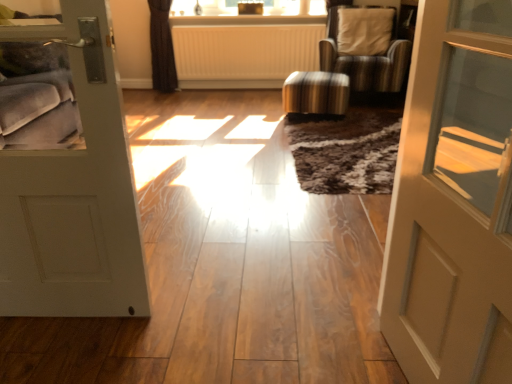
Identify the location of striped fabric chair at center. This screenshot has width=512, height=384. (369, 58).

What do you see at coordinates (369, 58) in the screenshot? I see `striped fabric chair at center` at bounding box center [369, 58].

Image resolution: width=512 pixels, height=384 pixels. Describe the element at coordinates (316, 93) in the screenshot. I see `striped fabric stool at center` at that location.

What do you see at coordinates (245, 51) in the screenshot?
I see `white ribbed radiator at center` at bounding box center [245, 51].

Describe the element at coordinates (453, 200) in the screenshot. I see `matte beige door at right, the 1th door in the right-to-left sequence` at that location.

Identify the location of striped fabric chair at center. (369, 58).

From a real-world perspective, is striped fabric stool at center located beneath white ribbed radiator at center?

Yes, from a real-world perspective, striped fabric stool at center is beneath white ribbed radiator at center.

Is the surface of striped fabric stool at center in direct contact with white ribbed radiator at center?

striped fabric stool at center and white ribbed radiator at center are clearly separated.

Can you confirm if striped fabric stool at center is bigger than white ribbed radiator at center?

No, striped fabric stool at center is not bigger than white ribbed radiator at center.

From the image's perspective, which one is positioned lower, striped fabric stool at center or white ribbed radiator at center?

striped fabric stool at center is shown below in the image.

Is striped fabric chair at center taller than white ribbed radiator at center?

Yes, striped fabric chair at center is taller than white ribbed radiator at center.

Does point (379, 69) appear closer or farther from the camera than point (270, 61)?

Point (379, 69).

From the image's perspective, which object appears higher, striped fabric chair at center or white ribbed radiator at center?

white ribbed radiator at center.

Is striped fabric chair at center directly adjacent to white ribbed radiator at center?

No, striped fabric chair at center is not touching white ribbed radiator at center.

Could you measure the distance between matte beige door at right, marked as the second door in a left-to-right arrangement, and striped fabric chair at center?

A distance of 2.90 meters exists between matte beige door at right, marked as the second door in a left-to-right arrangement, and striped fabric chair at center.

Between matte beige door at right, the 1th door in the right-to-left sequence, and striped fabric chair at center, which one has smaller size?

With smaller size is matte beige door at right, the 1th door in the right-to-left sequence.

From the image's perspective, is matte beige door at right, the 1th door in the right-to-left sequence, located beneath striped fabric chair at center?

Yes, from the image's perspective, matte beige door at right, the 1th door in the right-to-left sequence, is beneath striped fabric chair at center.

Could you tell me if matte beige door at right, the 1th door in the right-to-left sequence, is turned towards striped fabric chair at center?

No, matte beige door at right, the 1th door in the right-to-left sequence, is not turned towards striped fabric chair at center.

How different are the orientations of matte beige door at right, the 1th door in the right-to-left sequence, and white ribbed radiator at center in degrees?

The facing directions of matte beige door at right, the 1th door in the right-to-left sequence, and white ribbed radiator at center are 80 degrees apart.

Which object is further away from the camera, matte beige door at right, marked as the second door in a left-to-right arrangement, or white ribbed radiator at center?

white ribbed radiator at center.

Considering the relative positions of matte beige door at right, marked as the second door in a left-to-right arrangement, and white ribbed radiator at center in the image provided, is matte beige door at right, marked as the second door in a left-to-right arrangement, to the left of white ribbed radiator at center from the viewer's perspective?

No.

Based on the photo, would you consider matte beige door at right, the 1th door in the right-to-left sequence, to be distant from white ribbed radiator at center?

Yes.

Considering the sizes of objects white ribbed radiator at center and striped fabric chair at center in the image provided, who is thinner, white ribbed radiator at center or striped fabric chair at center?

white ribbed radiator at center.

Would you say striped fabric chair at center is part of white ribbed radiator at center's contents?

That's incorrect, striped fabric chair at center is not inside white ribbed radiator at center.

Could you tell me if white ribbed radiator at center is turned towards striped fabric chair at center?

No, white ribbed radiator at center is not facing towards striped fabric chair at center.

From a real-world perspective, is white ribbed radiator at center on top of striped fabric chair at center?

No, from a real-world perspective, white ribbed radiator at center is not over striped fabric chair at center

Is point (328, 111) closer or farther from the camera than point (351, 75)?

Point (328, 111) is closer to the camera than point (351, 75).

Does striped fabric stool at center have a greater width compared to striped fabric chair at center?

In fact, striped fabric stool at center might be narrower than striped fabric chair at center.

From the picture: Is striped fabric stool at center spatially inside striped fabric chair at center, or outside of it?

striped fabric stool at center is located beyond the bounds of striped fabric chair at center.

Where is `stool beneath the striped fabric chair at center (from a real-world perspective)`? The width and height of the screenshot is (512, 384). stool beneath the striped fabric chair at center (from a real-world perspective) is located at coordinates (316, 93).

Does striped fabric chair at center have a lesser height compared to striped fabric stool at center?

No, striped fabric chair at center is not shorter than striped fabric stool at center.

Considering the relative positions of striped fabric chair at center and striped fabric stool at center in the image provided, is striped fabric chair at center in front of striped fabric stool at center?

No, striped fabric chair at center is behind striped fabric stool at center.

Between point (360, 79) and point (315, 84), which one is positioned behind?

The point (360, 79) is farther from the camera.

Can you confirm if striped fabric chair at center is smaller than striped fabric stool at center?

No.

At what (x,y) coordinates should I click in order to perform the action: click on radiator above the striped fabric stool at center (from the image's perspective). Please return your answer as a coordinate pair (x, y). Looking at the image, I should click on (245, 51).

This screenshot has width=512, height=384. I want to click on chair above the white ribbed radiator at center (from a real-world perspective), so click(x=369, y=58).

When comparing their distances from white ribbed radiator at center, does matte beige door at right, marked as the second door in a left-to-right arrangement, or striped fabric chair at center seem closer?

Based on the image, striped fabric chair at center appears to be nearer to white ribbed radiator at center.

Which object lies nearer to the anchor point striped fabric chair at center, matte beige door at right, the 1th door in the right-to-left sequence, or white matte door at left, the 1th door viewed from the left?

white matte door at left, the 1th door viewed from the left, lies closer to striped fabric chair at center than the other object.

When comparing their distances from white matte door at left, placed as the second door when sorted from right to left, does white ribbed radiator at center or striped fabric chair at center seem closer?

Based on the image, white ribbed radiator at center appears to be nearer to white matte door at left, placed as the second door when sorted from right to left.

Considering their positions, is white ribbed radiator at center positioned closer to striped fabric stool at center than matte beige door at right, the 1th door in the right-to-left sequence?

Among the two, white ribbed radiator at center is located nearer to striped fabric stool at center.

Looking at the image, which one is located further to matte beige door at right, marked as the second door in a left-to-right arrangement, white matte door at left, the 1th door viewed from the left, or white ribbed radiator at center?

Based on the image, white ribbed radiator at center appears to be further to matte beige door at right, marked as the second door in a left-to-right arrangement.

From the picture: Looking at the image, which one is located closer to white ribbed radiator at center, white matte door at left, placed as the second door when sorted from right to left, or striped fabric chair at center?

Among the two, striped fabric chair at center is located nearer to white ribbed radiator at center.

Considering their positions, is striped fabric stool at center positioned further to white matte door at left, the 1th door viewed from the left, than matte beige door at right, marked as the second door in a left-to-right arrangement?

Among the two, matte beige door at right, marked as the second door in a left-to-right arrangement, is located further to white matte door at left, the 1th door viewed from the left.

Which object lies further to the anchor point white ribbed radiator at center, striped fabric chair at center or white matte door at left, placed as the second door when sorted from right to left?

Among the two, white matte door at left, placed as the second door when sorted from right to left, is located further to white ribbed radiator at center.

In order to click on door between matte beige door at right, the 1th door in the right-to-left sequence, and striped fabric chair at center in the front-back direction in this screenshot , I will do `click(66, 169)`.

Where is `chair between striped fabric stool at center and white ribbed radiator at center from front to back`? The width and height of the screenshot is (512, 384). chair between striped fabric stool at center and white ribbed radiator at center from front to back is located at coordinates (369, 58).

You are a GUI agent. You are given a task and a screenshot of the screen. Output one action in this format:
    pyautogui.click(x=<x>, y=<y>)
    Task: Click on the stool between matte beige door at right, marked as the second door in a left-to-right arrangement, and striped fabric chair at center from front to back
    
    Given the screenshot: What is the action you would take?
    pyautogui.click(x=316, y=93)

This screenshot has width=512, height=384. I want to click on chair between matte beige door at right, marked as the second door in a left-to-right arrangement, and white ribbed radiator at center from front to back, so pyautogui.click(x=369, y=58).